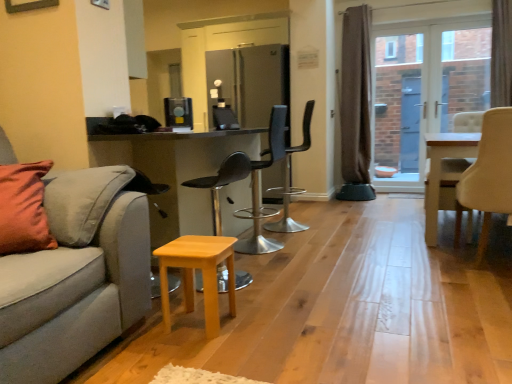
Describe the element at coordinates (178, 112) in the screenshot. I see `satin silver coffee machine at center, the second appliance viewed from the right` at that location.

Image resolution: width=512 pixels, height=384 pixels. What are the coordinates of `black plastic chair at center, the 3th chair from the right` in the screenshot? It's located at [x=261, y=189].

What is the approximate width of white leather chair at right, the first chair in the right-to-left sequence?

It is 23.52 inches.

Describe the element at coordinates (488, 175) in the screenshot. I see `white leather chair at right, which appears as the fourth chair when viewed from the left` at that location.

The height and width of the screenshot is (384, 512). Describe the element at coordinates (291, 180) in the screenshot. I see `black leather bar stool at center, the third chair viewed from the left` at that location.

Describe the element at coordinates (425, 90) in the screenshot. This screenshot has height=384, width=512. I see `clear glass door at center` at that location.

Identify the location of white wooden table at center. (441, 171).

What are the coordinates of `satin silver coffee machine at center, which ranks as the second appliance in back-to-front order` in the screenshot? It's located at (178, 112).

Does wooden stool at center, which ranks as the first chair in left-to-right order, appear on the right side of white wooden table at center?

No, wooden stool at center, which ranks as the first chair in left-to-right order, is not to the right of white wooden table at center.

Would you say white wooden table at center is part of wooden stool at center, which ranks as the first chair in left-to-right order,'s contents?

No.

Which of these two, wooden stool at center, the 4th chair in the right-to-left sequence, or white wooden table at center, stands shorter?

white wooden table at center is shorter.

How different are the orientations of wooden stool at center, which ranks as the first chair in left-to-right order, and white wooden table at center in degrees?

0.313 degrees.

Does brown fabric curtain at upper right, the first curtain from the right, turn towards satin silver coffee machine at center, which ranks as the second appliance in back-to-front order?

No, brown fabric curtain at upper right, the first curtain from the right, does not turn towards satin silver coffee machine at center, which ranks as the second appliance in back-to-front order.

From a real-world perspective, is brown fabric curtain at upper right, the 2th curtain positioned from the left, located higher than satin silver coffee machine at center, the 2th appliance when ordered from top to bottom?

Yes.

How many degrees apart are the facing directions of brown fabric curtain at upper right, which appears as the 1th curtain when viewed from the front, and satin silver coffee machine at center, the first appliance from the bottom?

brown fabric curtain at upper right, which appears as the 1th curtain when viewed from the front, and satin silver coffee machine at center, the first appliance from the bottom, are facing 151 degrees away from each other.

Consider the image. From a real-world perspective, is clear glass door at center beneath light gray fabric couch at left?

No, from a real-world perspective, clear glass door at center is not beneath light gray fabric couch at left.

Is clear glass door at center facing away from light gray fabric couch at left?

No.

From a real-world perspective, which is physically below, light wood stool at lower center or black leather bar stool at center, the third chair viewed from the left?

light wood stool at lower center, from a real-world perspective.

How different are the orientations of light wood stool at lower center and black leather bar stool at center, the third chair viewed from the left, in degrees?

light wood stool at lower center and black leather bar stool at center, the third chair viewed from the left, are facing 176 degrees away from each other.

Is light wood stool at lower center facing away from black leather bar stool at center, the third chair viewed from the left?

No, light wood stool at lower center is not facing the opposite direction of black leather bar stool at center, the third chair viewed from the left.

Is light wood stool at lower center in front of or behind black leather bar stool at center, which appears as the second chair when viewed from the right, in the image?

light wood stool at lower center is in front of black leather bar stool at center, which appears as the second chair when viewed from the right.

Considering the positions of point (179, 99) and point (464, 177), is point (179, 99) closer or farther from the camera than point (464, 177)?

Point (179, 99) is positioned farther from the camera compared to point (464, 177).

Can you see satin silver coffee machine at center, the 2th appliance when ordered from top to bottom, touching white leather chair at right, which appears as the fourth chair when viewed from the left?

No.

Considering the relative sizes of satin silver coffee machine at center, the first appliance from the bottom, and white leather chair at right, the first chair in the right-to-left sequence, in the image provided, is satin silver coffee machine at center, the first appliance from the bottom, bigger than white leather chair at right, the first chair in the right-to-left sequence,?

No.

Between satin silver coffee machine at center, the first appliance from the bottom, and white leather chair at right, the first chair in the right-to-left sequence, which one is positioned behind?

satin silver coffee machine at center, the first appliance from the bottom, is behind.

Is white leather chair at right, the first chair in the right-to-left sequence, bigger than wooden stool at center, which ranks as the first chair in left-to-right order?

Yes.

This screenshot has width=512, height=384. I want to click on the 1st chair above the wooden stool at center, which ranks as the first chair in left-to-right order (from the image's perspective), so click(488, 175).

Does white leather chair at right, the first chair in the right-to-left sequence, turn towards wooden stool at center, the 4th chair in the right-to-left sequence?

No, white leather chair at right, the first chair in the right-to-left sequence, is not aimed at wooden stool at center, the 4th chair in the right-to-left sequence.

Is white leather chair at right, which appears as the fourth chair when viewed from the left, next to wooden stool at center, which ranks as the first chair in left-to-right order, and touching it?

No, white leather chair at right, which appears as the fourth chair when viewed from the left, is not beside wooden stool at center, which ranks as the first chair in left-to-right order.

From a real-world perspective, is satin silver refrigerator at center, acting as the 2th appliance starting from the bottom, located higher than black leather bar stool at center, the third chair viewed from the left?

Correct, in the physical world, satin silver refrigerator at center, acting as the 2th appliance starting from the bottom, is higher than black leather bar stool at center, the third chair viewed from the left.

Who is bigger, satin silver refrigerator at center, which is the 1th appliance in top-to-bottom order, or black leather bar stool at center, the third chair viewed from the left?

satin silver refrigerator at center, which is the 1th appliance in top-to-bottom order, is bigger.

Can you tell me how much satin silver refrigerator at center, the first appliance when ordered from right to left, and black leather bar stool at center, the third chair viewed from the left, differ in facing direction?

The facing directions of satin silver refrigerator at center, the first appliance when ordered from right to left, and black leather bar stool at center, the third chair viewed from the left, are 86.1 degrees apart.

Could you tell me if satin silver refrigerator at center, acting as the 2th appliance starting from the bottom, is turned towards black leather bar stool at center, which appears as the second chair when viewed from the right?

Yes, satin silver refrigerator at center, acting as the 2th appliance starting from the bottom, is turned towards black leather bar stool at center, which appears as the second chair when viewed from the right.

Identify the location of table that is on the right side of wooden stool at center, the 4th chair in the right-to-left sequence. This screenshot has width=512, height=384. (441, 171).

Find the location of `the 2nd curtain above when counting from the satin silver coffee machine at center, the first appliance from the bottom (from the image's perspective)`. the 2nd curtain above when counting from the satin silver coffee machine at center, the first appliance from the bottom (from the image's perspective) is located at coordinates [x=501, y=53].

Based on their spatial positions, is white leather chair at right, the first chair in the right-to-left sequence, or satin silver refrigerator at center, placed as the second appliance when sorted from left to right, further from black plastic chair at center, the 3th chair from the right?

Among the two, white leather chair at right, the first chair in the right-to-left sequence, is located further to black plastic chair at center, the 3th chair from the right.

When comparing their distances from white wooden table at center, does brown textured curtain at right, which is the 1th curtain in back-to-front order, or clear glass door at center seem further?

brown textured curtain at right, which is the 1th curtain in back-to-front order, is positioned further to the anchor white wooden table at center.

Considering their positions, is brown fabric curtain at upper right, the first curtain from the right, positioned closer to satin silver coffee machine at center, the second appliance viewed from the right, than light gray fabric couch at left?

Based on the image, light gray fabric couch at left appears to be nearer to satin silver coffee machine at center, the second appliance viewed from the right.

Estimate the real-world distances between objects in this image. Which object is closer to light gray fabric couch at left, brown fabric curtain at upper right, the 2th curtain positioned from the left, or wooden stool at center, which ranks as the first chair in left-to-right order?

wooden stool at center, which ranks as the first chair in left-to-right order, is closer to light gray fabric couch at left.

From the image, which object appears to be nearer to brown textured curtain at right, positioned as the 2th curtain in right-to-left order, wooden stool at center, which ranks as the first chair in left-to-right order, or satin silver coffee machine at center, which ranks as the 1th appliance in front-to-back order?

satin silver coffee machine at center, which ranks as the 1th appliance in front-to-back order.

Which object lies nearer to the anchor point black leather bar stool at center, which appears as the second chair when viewed from the right, satin silver refrigerator at center, which appears as the second appliance when viewed from the front, or white leather chair at right, which appears as the fourth chair when viewed from the left?

satin silver refrigerator at center, which appears as the second appliance when viewed from the front, is closer to black leather bar stool at center, which appears as the second chair when viewed from the right.

Looking at the image, which one is located further to wooden stool at center, the 4th chair in the right-to-left sequence, brown fabric curtain at upper right, the first curtain from the right, or white wooden table at center?

brown fabric curtain at upper right, the first curtain from the right.

Estimate the real-world distances between objects in this image. Which object is further from light gray fabric couch at left, clear glass door at center or satin silver coffee machine at center, which ranks as the 1th appliance in front-to-back order?

clear glass door at center is further to light gray fabric couch at left.

Where is `curtain between satin silver coffee machine at center, the 1th appliance in the left-to-right sequence, and white wooden table at center, in the horizontal direction`? This screenshot has width=512, height=384. curtain between satin silver coffee machine at center, the 1th appliance in the left-to-right sequence, and white wooden table at center, in the horizontal direction is located at coordinates (356, 95).

Identify the location of window screen located between light gray fabric couch at left and brown fabric curtain at upper right, the second curtain positioned from the back, in the left-right direction. (425, 90).

Where is `curtain located between white leather chair at right, which appears as the fourth chair when viewed from the left, and brown textured curtain at right, positioned as the 1th curtain in left-to-right order, in the depth direction`? The image size is (512, 384). curtain located between white leather chair at right, which appears as the fourth chair when viewed from the left, and brown textured curtain at right, positioned as the 1th curtain in left-to-right order, in the depth direction is located at coordinates (501, 53).

I want to click on table between satin silver coffee machine at center, which ranks as the 1th appliance in front-to-back order, and brown fabric curtain at upper right, the second curtain positioned from the back, from left to right, so click(441, 171).